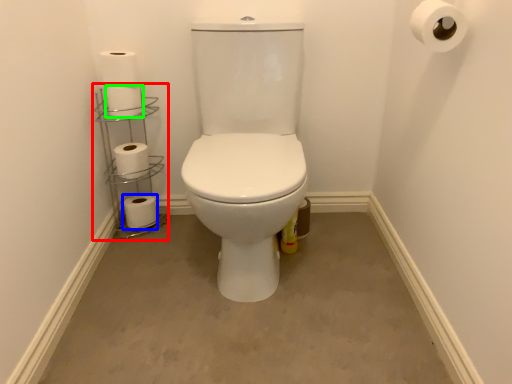
Question: Which is nearer to the shelf (highlighted by a red box)? toilet paper (highlighted by a blue box) or toilet paper (highlighted by a green box).

Choices:
 (A) toilet paper
 (B) toilet paper

Answer: (A)